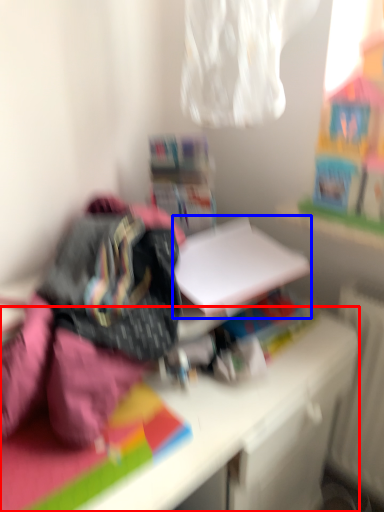
Question: Among these objects, which one is nearest to the camera, desk (highlighted by a red box) or paperback book (highlighted by a blue box)?

Choices:
 (A) desk
 (B) paperback book

Answer: (A)